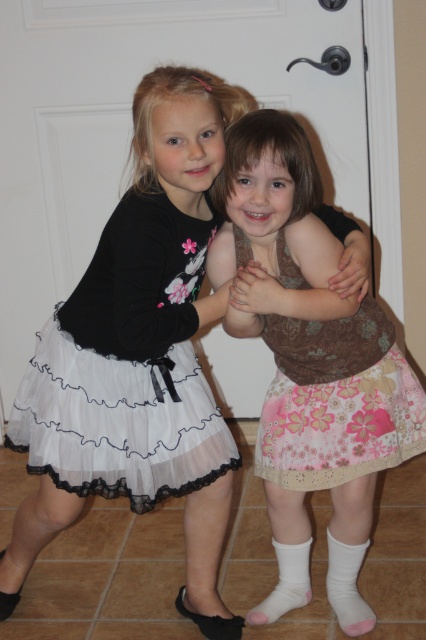
Question: Estimate the real-world distances between objects in this image. Which object is closer to the floral cotton skirt at center?

Choices:
 (A) pink floral skirt at center
 (B) white sheer skirt at center

Answer: (A)

Question: Is white sheer skirt at center below floral cotton skirt at center?

Choices:
 (A) no
 (B) yes

Answer: (B)

Question: Observing the image, what is the correct spatial positioning of pink floral skirt at center in reference to white sheer skirt at center?

Choices:
 (A) right
 (B) left

Answer: (A)

Question: Which of the following is the farthest from the observer?

Choices:
 (A) (422, 412)
 (B) (138, 260)
 (C) (298, 516)

Answer: (C)

Question: Which point is closer to the camera?

Choices:
 (A) (284, 422)
 (B) (371, 310)

Answer: (B)

Question: Can you confirm if pink floral skirt at center is positioned above floral cotton skirt at center?

Choices:
 (A) no
 (B) yes

Answer: (A)